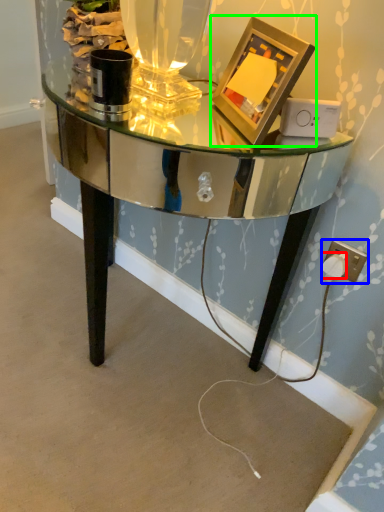
Question: Based on their relative distances, which object is nearer to plug (highlighted by a red box)? Choose from electric outlet (highlighted by a blue box) and picture frame (highlighted by a green box).

Choices:
 (A) electric outlet
 (B) picture frame

Answer: (A)